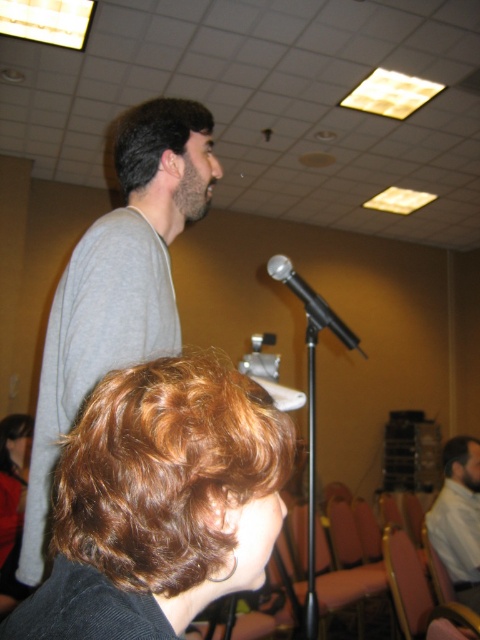
Question: Is light blue shirt at center to the left of dark brown curly hair at upper center from the viewer's perspective?

Choices:
 (A) no
 (B) yes

Answer: (B)

Question: Which point is closer to the camera?

Choices:
 (A) brown curly hair at upper left
 (B) gray matte sweater at upper left

Answer: (B)

Question: Which of the following is the closest to the observer?

Choices:
 (A) (320, 320)
 (B) (168, 193)
 (C) (440, 502)

Answer: (A)

Question: Can you confirm if gray matte sweater at upper left is positioned below dark brown curly hair at upper center?

Choices:
 (A) yes
 (B) no

Answer: (B)

Question: Which object is closer to the camera taking this photo?

Choices:
 (A) light blue shirt at center
 (B) brown curly hair at lower left

Answer: (B)

Question: Is brown curly hair at lower left positioned behind dark brown curly hair at upper center?

Choices:
 (A) no
 (B) yes

Answer: (A)